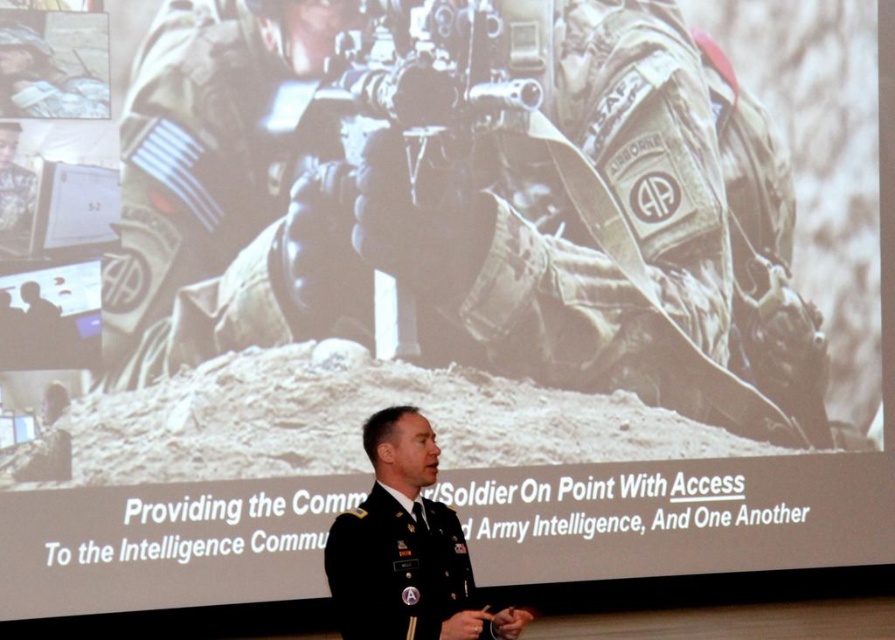
Does matte black rifle at center appear under black uniform at center?

Actually, matte black rifle at center is above black uniform at center.

Is point (395, 285) less distant than point (408, 579)?

That is False.

Is point (422, 93) positioned behind point (369, 504)?

Yes.

Locate an element on the screen. The image size is (895, 640). matte black rifle at center is located at coordinates (430, 86).